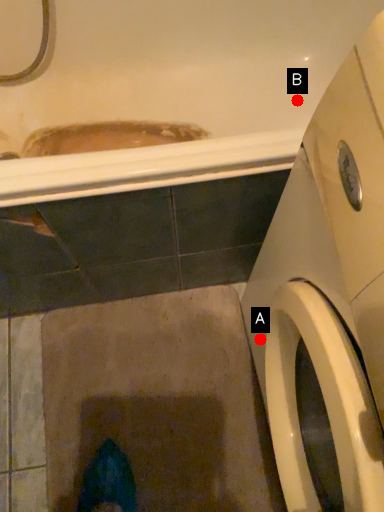
Question: Two points are circled on the image, labeled by A and B beside each circle. Among these points, which one is nearest to the camera?

Choices:
 (A) A is closer
 (B) B is closer

Answer: (A)